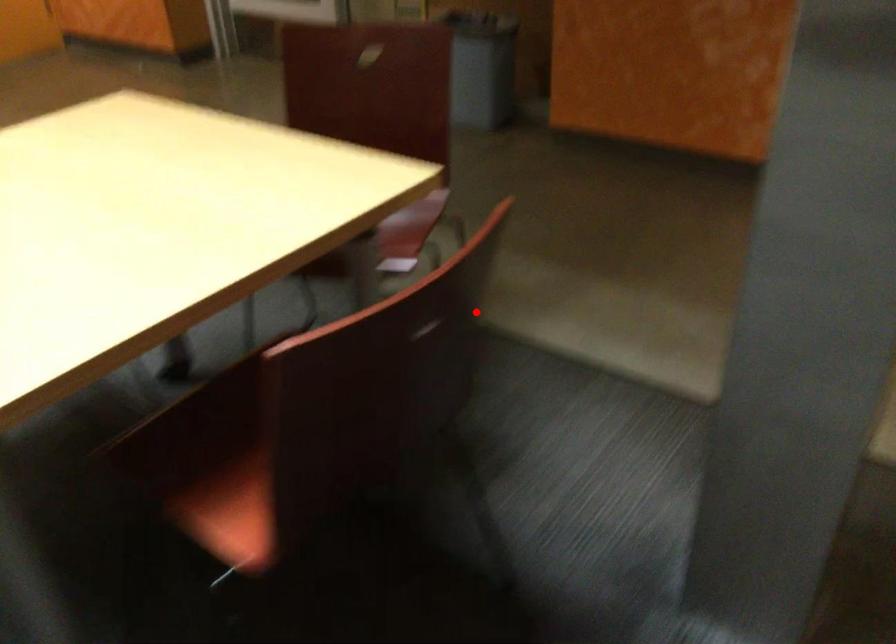
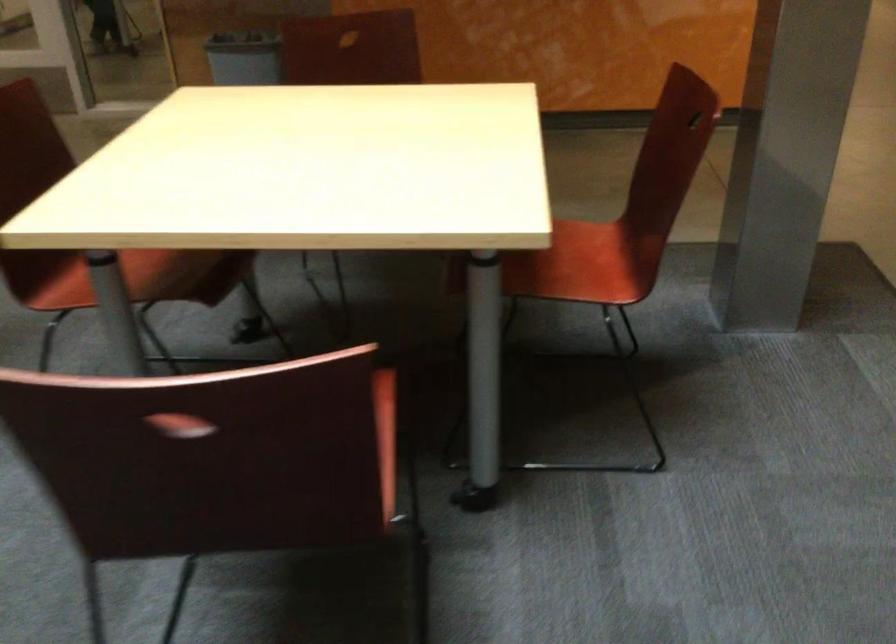
Question: I am providing you with two images of the same scene from different viewpoints. A red point is marked on the first image. At the location where the point appears in image 1, is it still visible in image 2?

Choices:
 (A) Yes
 (B) No

Answer: (A)